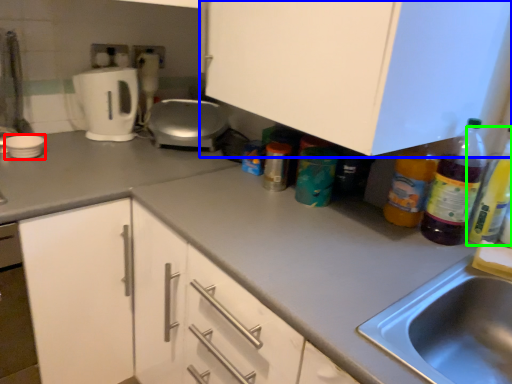
Question: Estimate the real-world distances between objects in this image. Which object is closer to appliance (highlighted by a red box), cabinetry (highlighted by a blue box) or bottle (highlighted by a green box)?

Choices:
 (A) cabinetry
 (B) bottle

Answer: (A)